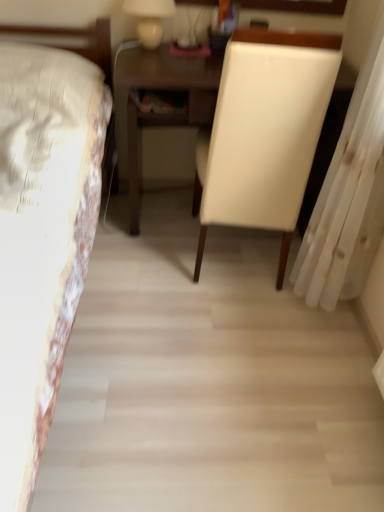
Locate an element on the screen. This screenshot has height=512, width=384. vacant space situated on the left part of white leather chair at center is located at coordinates (140, 269).